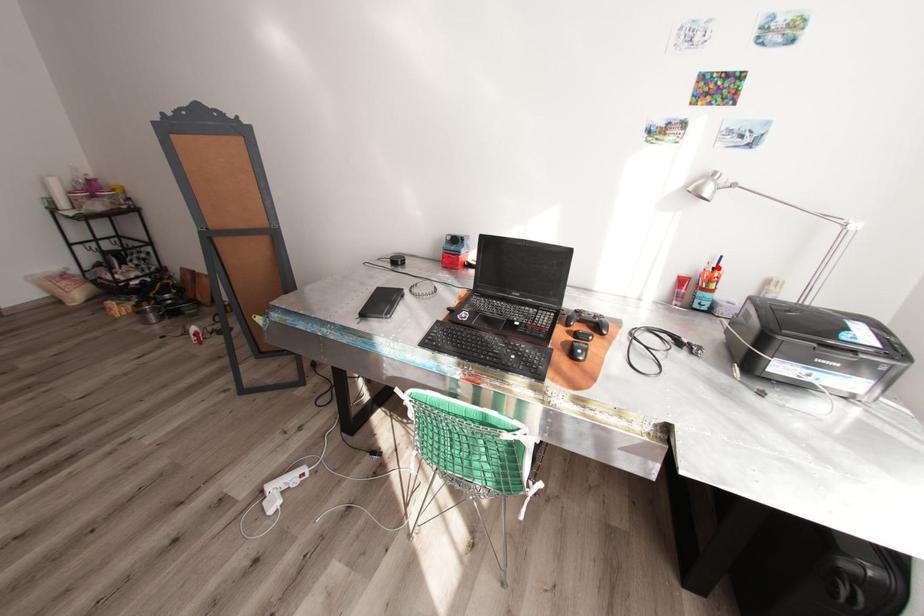
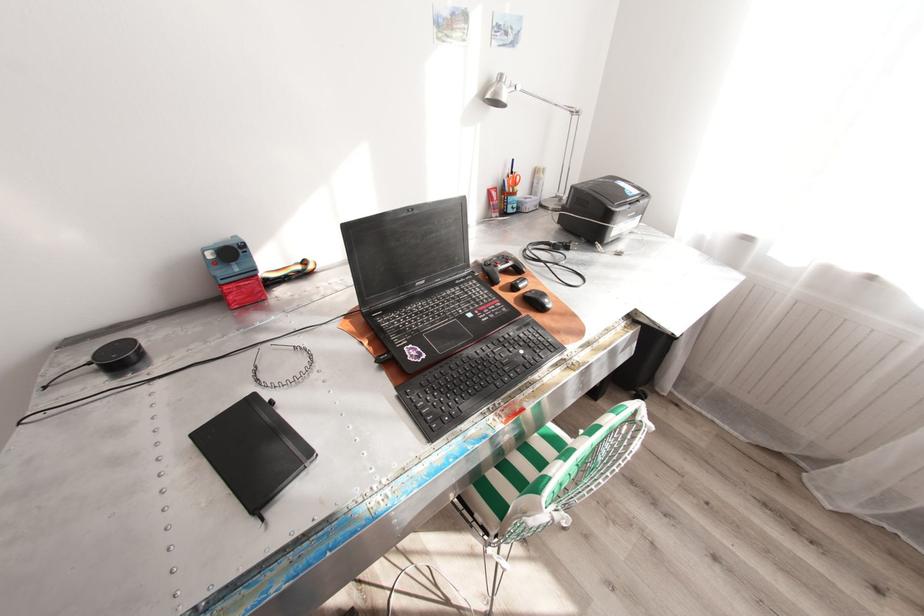
Find the pixel in the second image that matches the highlighted location in the first image.

(517, 172)